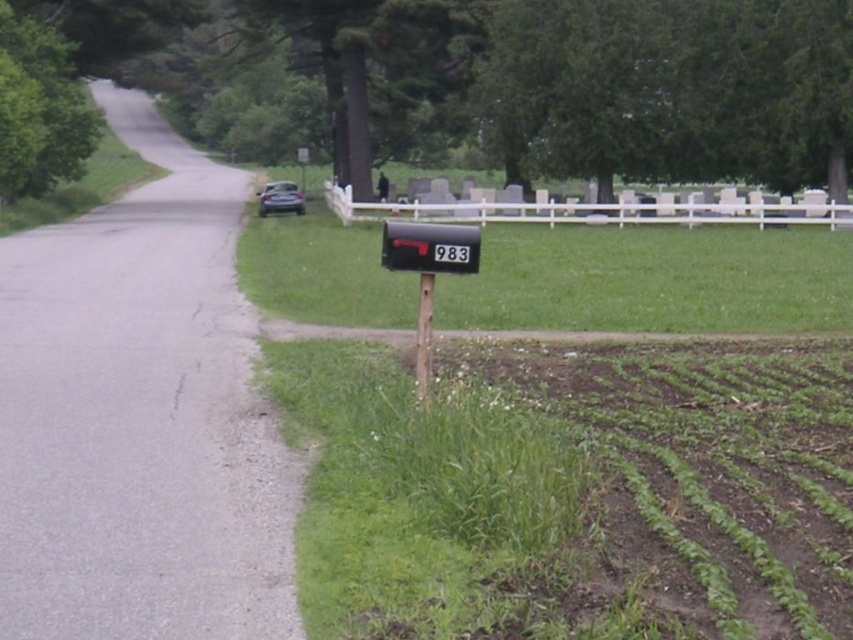
Question: Which of the following is the farthest from the observer?

Choices:
 (A) green grass at lower right
 (B) metallic black mailbox at center

Answer: (B)

Question: Which object appears closest to the camera in this image?

Choices:
 (A) metallic mailbox at center
 (B) green grass at lower right
 (C) metallic black mailbox at center

Answer: (B)

Question: Which object is positioned closest to the metallic mailbox at center?

Choices:
 (A) green grass at lower right
 (B) metallic black mailbox at center

Answer: (B)

Question: Does metallic black mailbox at center appear on the right side of metallic mailbox at center?

Choices:
 (A) yes
 (B) no

Answer: (A)

Question: Is metallic black mailbox at center positioned behind metallic mailbox at center?

Choices:
 (A) no
 (B) yes

Answer: (B)

Question: Can you confirm if green grass at lower right is bigger than metallic black mailbox at center?

Choices:
 (A) no
 (B) yes

Answer: (B)